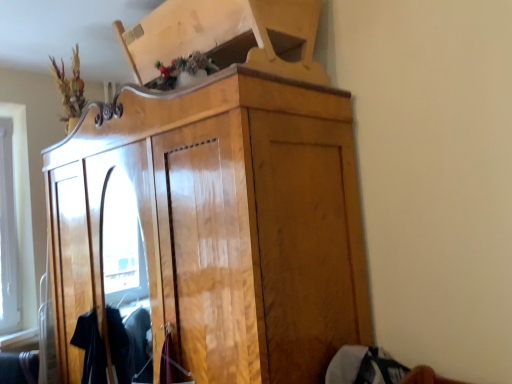
Locate an element on the screen. This screenshot has width=512, height=384. glossy wood cupboard at center is located at coordinates (223, 223).

Measure the distance between point (94, 135) and camera.

The depth of point (94, 135) is 6.83 feet.

Describe the element at coordinates (223, 223) in the screenshot. This screenshot has height=384, width=512. I see `glossy wood cupboard at center` at that location.

You are a GUI agent. You are given a task and a screenshot of the screen. Output one action in this format:
    pyautogui.click(x=<x>, y=<y>)
    Task: Click on the gray cotton sweater at lower right
    This screenshot has width=512, height=384.
    Given the screenshot: What is the action you would take?
    pyautogui.click(x=362, y=366)

Image resolution: width=512 pixels, height=384 pixels. What do you see at coordinates (362, 366) in the screenshot?
I see `gray cotton sweater at lower right` at bounding box center [362, 366].

The width and height of the screenshot is (512, 384). In order to click on glossy wood cupboard at center in this screenshot , I will do `click(223, 223)`.

Considering the relative positions of gray cotton sweater at lower right and glossy wood cupboard at center in the image provided, is gray cotton sweater at lower right to the left of glossy wood cupboard at center from the viewer's perspective?

Incorrect, gray cotton sweater at lower right is not on the left side of glossy wood cupboard at center.

Is the depth of gray cotton sweater at lower right less than that of glossy wood cupboard at center?

No, gray cotton sweater at lower right is further to the viewer.

Considering the positions of point (386, 353) and point (357, 245), is point (386, 353) closer or farther from the camera than point (357, 245)?

Point (386, 353) appears to be closer to the viewer than point (357, 245).

From the image's perspective, is gray cotton sweater at lower right above glossy wood cupboard at center?

No, from the image's perspective, gray cotton sweater at lower right is not above glossy wood cupboard at center.

From a real-world perspective, is gray cotton sweater at lower right below glossy wood cupboard at center?

Yes, from a real-world perspective, gray cotton sweater at lower right is below glossy wood cupboard at center.

From the picture: Looking at their sizes, would you say gray cotton sweater at lower right is wider or thinner than glossy wood cupboard at center?

In the image, gray cotton sweater at lower right appears to be more narrow than glossy wood cupboard at center.

Between gray cotton sweater at lower right and glossy wood cupboard at center, which one has more height?

glossy wood cupboard at center.

Between gray cotton sweater at lower right and glossy wood cupboard at center, which one has smaller size?

With smaller size is gray cotton sweater at lower right.

Is gray cotton sweater at lower right located outside glossy wood cupboard at center?

Indeed, gray cotton sweater at lower right is completely outside glossy wood cupboard at center.

Is gray cotton sweater at lower right beside glossy wood cupboard at center?

No, gray cotton sweater at lower right is not with glossy wood cupboard at center.

Is gray cotton sweater at lower right looking in the opposite direction of glossy wood cupboard at center?

No, gray cotton sweater at lower right's orientation is not away from glossy wood cupboard at center.

Measure the distance between gray cotton sweater at lower right and glossy wood cupboard at center.

A distance of 28.78 inches exists between gray cotton sweater at lower right and glossy wood cupboard at center.

Where is `clothing located behind the glossy wood cupboard at center`? The height and width of the screenshot is (384, 512). clothing located behind the glossy wood cupboard at center is located at coordinates (362, 366).

Would you say glossy wood cupboard at center is to the left or to the right of gray cotton sweater at lower right in the picture?

Result: Based on their positions, glossy wood cupboard at center is located to the left of gray cotton sweater at lower right.

Between glossy wood cupboard at center and gray cotton sweater at lower right, which one is positioned in front?

glossy wood cupboard at center.

Is point (281, 87) farther from camera compared to point (351, 356)?

No, it is not.

From the image's perspective, is glossy wood cupboard at center located beneath gray cotton sweater at lower right?

No, from the image's perspective, glossy wood cupboard at center is not beneath gray cotton sweater at lower right.

From a real-world perspective, between glossy wood cupboard at center and gray cotton sweater at lower right, who is vertically lower?

In real-world perspective, gray cotton sweater at lower right is lower.

Is glossy wood cupboard at center wider than gray cotton sweater at lower right?

Correct, the width of glossy wood cupboard at center exceeds that of gray cotton sweater at lower right.

Does glossy wood cupboard at center have a lesser height compared to gray cotton sweater at lower right?

Incorrect, the height of glossy wood cupboard at center does not fall short of that of gray cotton sweater at lower right.

Considering the sizes of objects glossy wood cupboard at center and gray cotton sweater at lower right in the image provided, who is smaller, glossy wood cupboard at center or gray cotton sweater at lower right?

gray cotton sweater at lower right.

Is glossy wood cupboard at center surrounding gray cotton sweater at lower right?

That's incorrect, gray cotton sweater at lower right is not inside glossy wood cupboard at center.

Is glossy wood cupboard at center in contact with gray cotton sweater at lower right?

No, glossy wood cupboard at center is not next to gray cotton sweater at lower right.

Could you tell me if glossy wood cupboard at center is facing gray cotton sweater at lower right?

No, glossy wood cupboard at center does not turn towards gray cotton sweater at lower right.

What's the angular difference between glossy wood cupboard at center and gray cotton sweater at lower right's facing directions?

The angular difference between glossy wood cupboard at center and gray cotton sweater at lower right is 6.99 degrees.

The image size is (512, 384). Find the location of `cupboard located in front of the gray cotton sweater at lower right`. cupboard located in front of the gray cotton sweater at lower right is located at coordinates (223, 223).

The height and width of the screenshot is (384, 512). In order to click on clothing lying below the glossy wood cupboard at center (from the image's perspective) in this screenshot , I will do click(x=362, y=366).

This screenshot has width=512, height=384. What are the coordinates of `cupboard positioned vertically above the gray cotton sweater at lower right (from a real-world perspective)` in the screenshot? It's located at (223, 223).